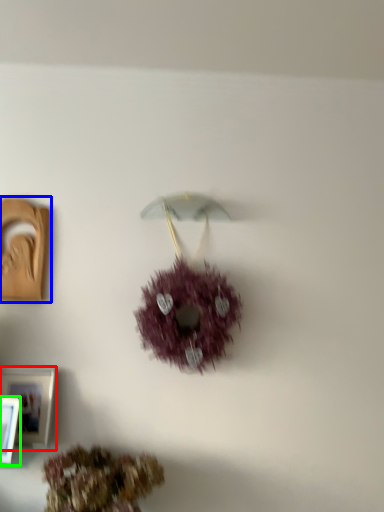
Question: Which object is the closest to the picture frame (highlighted by a red box)? Choose among these: picture frame (highlighted by a blue box) or picture frame (highlighted by a green box).

Choices:
 (A) picture frame
 (B) picture frame

Answer: (B)